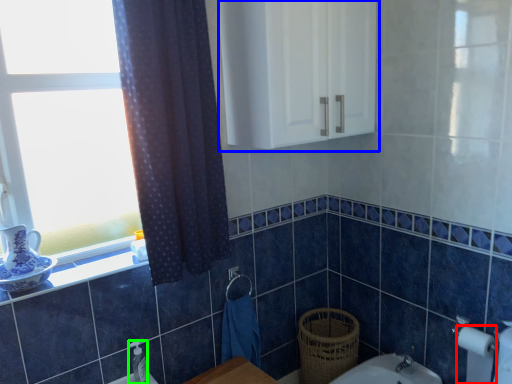
Question: Considering the real-world distances, which object is closest to toilet paper (highlighted by a red box)? medicine cabinet (highlighted by a blue box) or toiletry (highlighted by a green box).

Choices:
 (A) medicine cabinet
 (B) toiletry

Answer: (A)